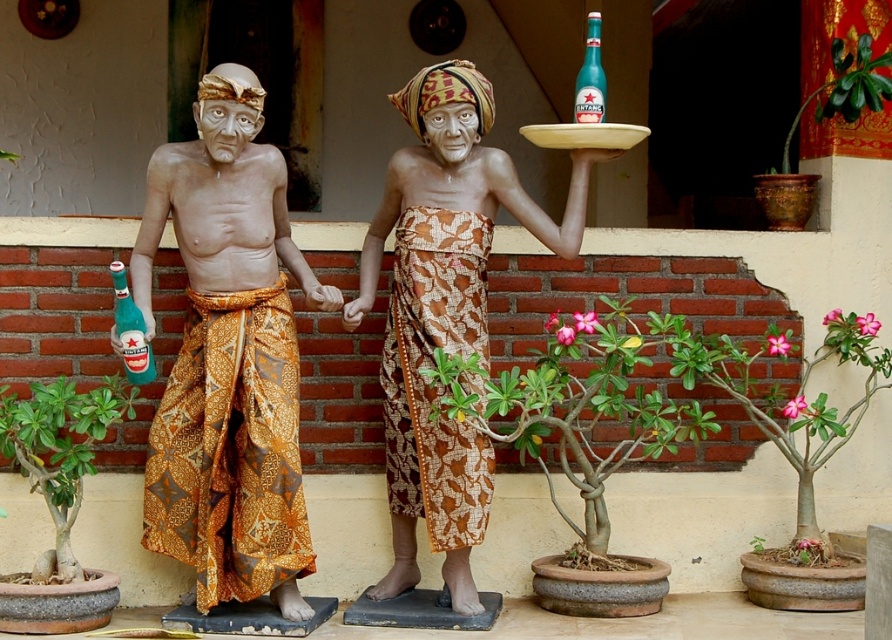
You are a photographer trying to capture both the batik fabric statue at center and the teal glass beer bottle at upper center in a single frame. Based on their positions, which object should you focus on first to ensure both are in the shot?

The batik fabric statue at center is positioned under the teal glass beer bottle at upper center, so focusing on the statue first will allow you to frame both objects together since the bottle is above it.

You are standing in front of the statues and want to take a photo of the point at coordinate point [418,168]. Your camera has a maximum focus range of 8 meters. Will the camera be able to focus on the point?

The distance of point [418,168] from the camera is 7.72 meters, which is within the camera maximum focus range of 8 meters. Therefore, the camera can focus on the point.

You are a photographer wanting to capture both the matte brown statue at center and the teal glass beer bottle at upper center in a single frame. Based on their positions, which object should you focus on first to ensure both are in the shot?

The matte brown statue at center is located below the teal glass beer bottle at upper center, so you should focus on the teal glass beer bottle at upper center first to ensure both are in the frame.